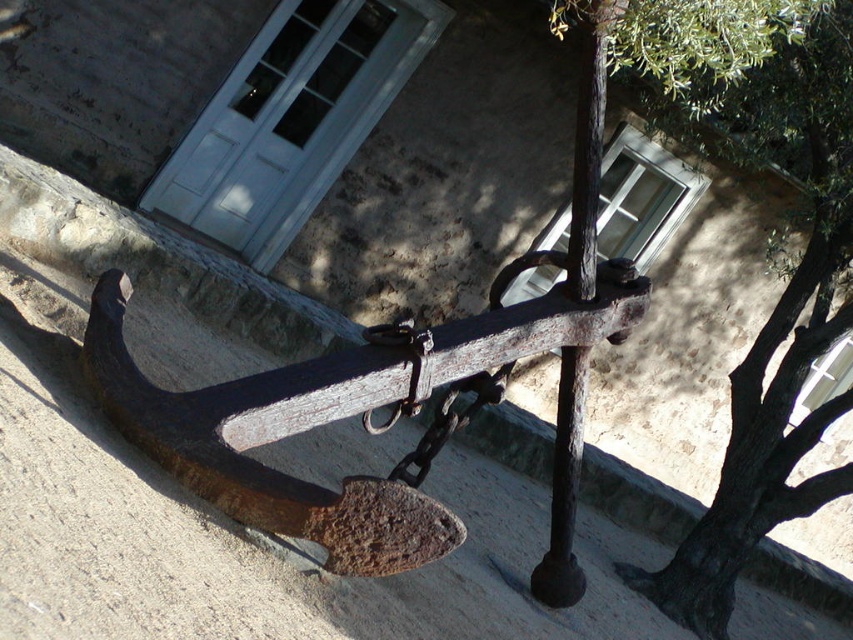
You are a GUI agent. You are given a task and a screenshot of the screen. Output one action in this format:
    pyautogui.click(x=<x>, y=<y>)
    Task: Click on the rusty metal anchor at center
    The height and width of the screenshot is (640, 853).
    Given the screenshot: What is the action you would take?
    pyautogui.click(x=366, y=413)

Does rusty metal anchor at center come behind green leafy tree at upper right?

No, it is in front of green leafy tree at upper right.

Who is more distant from viewer, [581,404] or [625,579]?

Point [625,579]

You are a GUI agent. You are given a task and a screenshot of the screen. Output one action in this format:
    pyautogui.click(x=<x>, y=<y>)
    Task: Click on the rusty metal anchor at center
    This screenshot has height=640, width=853.
    Given the screenshot: What is the action you would take?
    pyautogui.click(x=366, y=413)